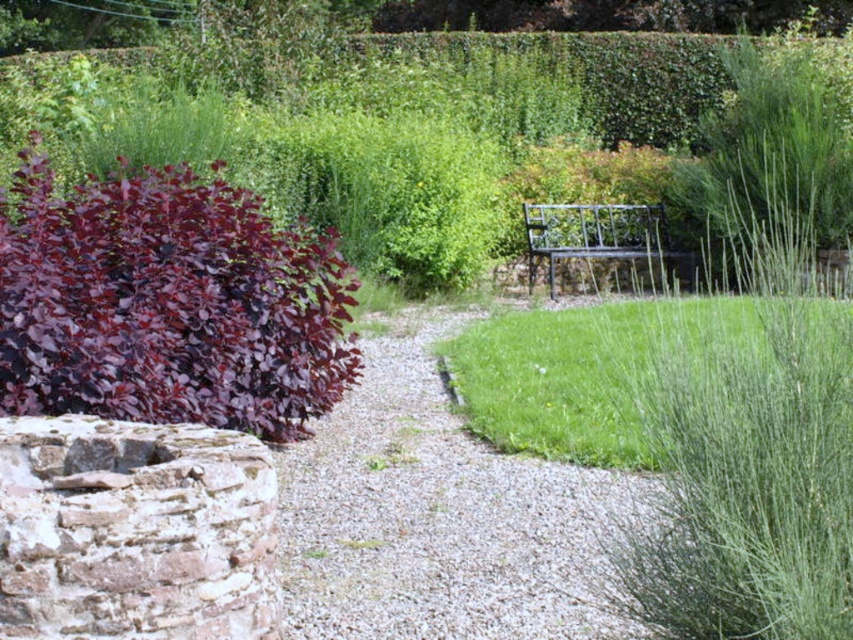
Question: Among these points, which one is farthest from the camera?

Choices:
 (A) (392, 317)
 (B) (590, 227)

Answer: (B)

Question: Does green grass at center appear under black metal bench at center?

Choices:
 (A) yes
 (B) no

Answer: (A)

Question: Which point is farther to the camera?

Choices:
 (A) purple glossy bush at left
 (B) rustic stone well at lower left

Answer: (A)

Question: Can you confirm if purple glossy bush at left is positioned to the right of green grass at center?

Choices:
 (A) no
 (B) yes

Answer: (A)

Question: Considering the real-world distances, which object is farthest from the green grass at center?

Choices:
 (A) rustic stone well at lower left
 (B) gray gravel at center
 (C) black metal bench at center

Answer: (B)

Question: Is gray gravel at center thinner than rustic stone well at lower left?

Choices:
 (A) no
 (B) yes

Answer: (A)